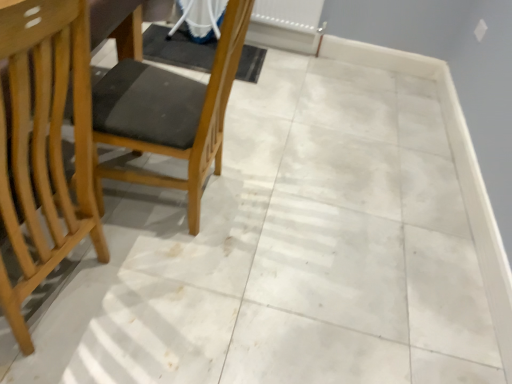
Question: Is wooden chair at left, positioned as the 1th chair in right-to-left order, not near white plastic radiator at upper center?

Choices:
 (A) yes
 (B) no

Answer: (A)

Question: Does wooden chair at left, which appears as the 2th chair when viewed from the left, have a lesser width compared to white plastic radiator at upper center?

Choices:
 (A) yes
 (B) no

Answer: (B)

Question: Considering the relative sizes of wooden chair at left, which appears as the 2th chair when viewed from the left, and white plastic radiator at upper center in the image provided, is wooden chair at left, which appears as the 2th chair when viewed from the left, wider than white plastic radiator at upper center?

Choices:
 (A) yes
 (B) no

Answer: (A)

Question: Is wooden chair at left, positioned as the 1th chair in right-to-left order, positioned with its back to white plastic radiator at upper center?

Choices:
 (A) no
 (B) yes

Answer: (A)

Question: From the image's perspective, would you say wooden chair at left, positioned as the 1th chair in right-to-left order, is positioned over white plastic radiator at upper center?

Choices:
 (A) no
 (B) yes

Answer: (A)

Question: Does point (309, 26) appear closer or farther from the camera than point (194, 230)?

Choices:
 (A) closer
 (B) farther

Answer: (B)

Question: Based on their sizes in the image, would you say white plastic radiator at upper center is bigger or smaller than wooden chair at left, positioned as the 1th chair in right-to-left order?

Choices:
 (A) small
 (B) big

Answer: (A)

Question: Considering the positions of white plastic radiator at upper center and wooden chair at left, positioned as the 1th chair in right-to-left order, in the image, is white plastic radiator at upper center taller or shorter than wooden chair at left, positioned as the 1th chair in right-to-left order,?

Choices:
 (A) short
 (B) tall

Answer: (A)

Question: From a real-world perspective, is white plastic radiator at upper center above or below wooden chair at left, which appears as the 2th chair when viewed from the left?

Choices:
 (A) above
 (B) below

Answer: (B)

Question: Would you say light wood chair at left, which is counted as the first chair, starting from the left, is to the left or to the right of wooden chair at left, positioned as the 1th chair in right-to-left order, in the picture?

Choices:
 (A) left
 (B) right

Answer: (A)

Question: In terms of width, does light wood chair at left, which is counted as the first chair, starting from the left, look wider or thinner when compared to wooden chair at left, positioned as the 1th chair in right-to-left order?

Choices:
 (A) thin
 (B) wide

Answer: (B)

Question: Is light wood chair at left, which is the second chair from right to left, in front of or behind wooden chair at left, positioned as the 1th chair in right-to-left order, in the image?

Choices:
 (A) behind
 (B) front

Answer: (B)

Question: From their relative heights in the image, would you say light wood chair at left, which is the second chair from right to left, is taller or shorter than wooden chair at left, which appears as the 2th chair when viewed from the left?

Choices:
 (A) tall
 (B) short

Answer: (A)

Question: From the image's perspective, relative to light wood chair at left, which is counted as the first chair, starting from the left, is white plastic radiator at upper center above or below?

Choices:
 (A) above
 (B) below

Answer: (A)

Question: Is white plastic radiator at upper center to the left or to the right of light wood chair at left, which is counted as the first chair, starting from the left, in the image?

Choices:
 (A) right
 (B) left

Answer: (A)